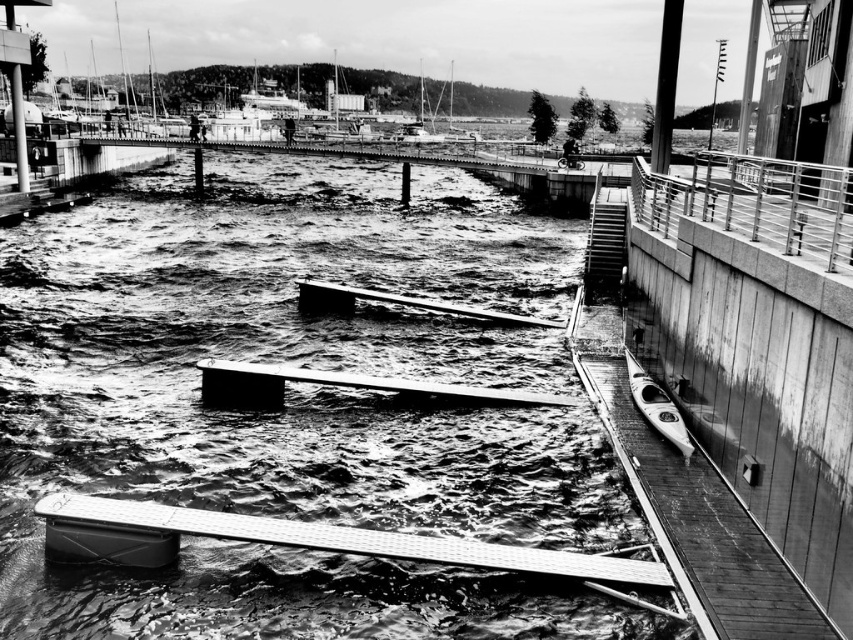
Does metallic silver railing at upper right appear over smooth gray dock at center?

Correct, metallic silver railing at upper right is located above smooth gray dock at center.

Who is more distant from viewer, (786, 176) or (544, 403)?

The point (786, 176) is more distant.

This screenshot has width=853, height=640. I want to click on metallic silver railing at upper right, so click(x=756, y=202).

Is rough water at center further to the viewer compared to metallic silver railing at upper right?

No, it is in front of metallic silver railing at upper right.

Measure the distance from rough water at center to metallic silver railing at upper right.

rough water at center is 11.90 meters from metallic silver railing at upper right.

Describe the element at coordinates (299, 404) in the screenshot. I see `rough water at center` at that location.

I want to click on rough water at center, so click(x=299, y=404).

Can you confirm if metallic silver railing at upper right is positioned above white glossy kayak at lower right?

Correct, metallic silver railing at upper right is located above white glossy kayak at lower right.

Between metallic silver railing at upper right and white glossy kayak at lower right, which one has more height?

metallic silver railing at upper right

At what (x,y) coordinates should I click in order to perform the action: click on metallic silver railing at upper right. Please return your answer as a coordinate pair (x, y). Looking at the image, I should click on (756, 202).

Identify the location of metallic silver railing at upper right. (756, 202).